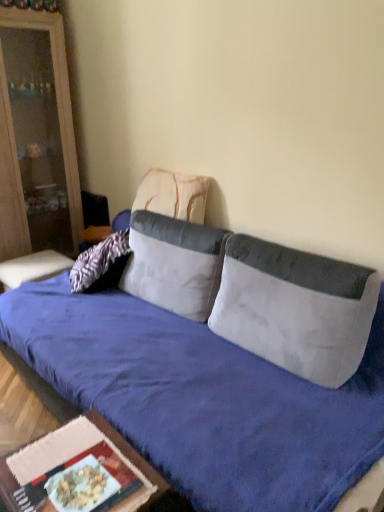
Question: Is velvet blue studio couch at center far from wooden table at lower left?

Choices:
 (A) yes
 (B) no

Answer: (B)

Question: Is velvet blue studio couch at center next to wooden table at lower left?

Choices:
 (A) yes
 (B) no

Answer: (B)

Question: Considering the relative positions of velvet blue studio couch at center and wooden table at lower left in the image provided, is velvet blue studio couch at center to the left of wooden table at lower left from the viewer's perspective?

Choices:
 (A) yes
 (B) no

Answer: (B)

Question: Is velvet blue studio couch at center at the right side of wooden table at lower left?

Choices:
 (A) yes
 (B) no

Answer: (A)

Question: Does velvet blue studio couch at center have a smaller size compared to wooden table at lower left?

Choices:
 (A) yes
 (B) no

Answer: (B)

Question: Is white fabric pillow at center, positioned as the 3th pillow in back-to-front order, bigger or smaller than white fabric pillow at center, arranged as the second pillow when viewed from the back?

Choices:
 (A) small
 (B) big

Answer: (A)

Question: Based on their positions, is white fabric pillow at center, the first pillow in the front-to-back sequence, located to the left or right of white fabric pillow at center, arranged as the second pillow when viewed from the back?

Choices:
 (A) left
 (B) right

Answer: (B)

Question: From their relative heights in the image, would you say white fabric pillow at center, the first pillow in the front-to-back sequence, is taller or shorter than white fabric pillow at center, arranged as the second pillow when viewed from the back?

Choices:
 (A) short
 (B) tall

Answer: (A)

Question: In the image, is white fabric pillow at center, the first pillow in the front-to-back sequence, positioned in front of or behind white fabric pillow at center, arranged as the second pillow when viewed from the back?

Choices:
 (A) front
 (B) behind

Answer: (A)

Question: Do you think textured beige pillow at center, the third pillow positioned from the front, is within matte wood cabinet at left, or outside of it?

Choices:
 (A) inside
 (B) outside

Answer: (B)

Question: Considering the positions of textured beige pillow at center, the third pillow positioned from the front, and matte wood cabinet at left in the image, is textured beige pillow at center, the third pillow positioned from the front, bigger or smaller than matte wood cabinet at left?

Choices:
 (A) small
 (B) big

Answer: (A)

Question: From the image's perspective, relative to matte wood cabinet at left, is textured beige pillow at center, the third pillow positioned from the front, above or below?

Choices:
 (A) above
 (B) below

Answer: (B)

Question: Considering the positions of textured beige pillow at center, marked as the first pillow in a back-to-front arrangement, and matte wood cabinet at left in the image, is textured beige pillow at center, marked as the first pillow in a back-to-front arrangement, taller or shorter than matte wood cabinet at left?

Choices:
 (A) short
 (B) tall

Answer: (A)

Question: Choose the correct answer: Is matte wood cabinet at left inside textured beige pillow at center, marked as the first pillow in a back-to-front arrangement, or outside it?

Choices:
 (A) inside
 (B) outside

Answer: (B)

Question: Is matte wood cabinet at left wider or thinner than textured beige pillow at center, the third pillow positioned from the front?

Choices:
 (A) thin
 (B) wide

Answer: (B)